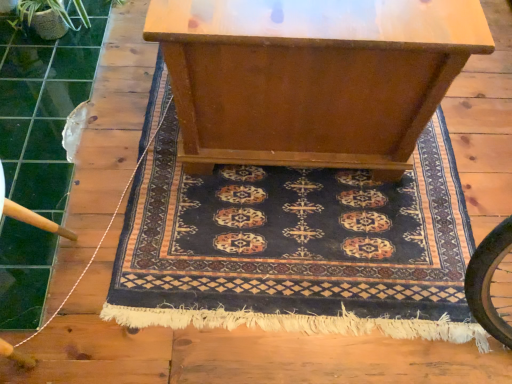
Question: From the image's perspective, is dark blue woven rug at center below wooden table at center?

Choices:
 (A) no
 (B) yes

Answer: (B)

Question: Can you see dark blue woven rug at center touching wooden table at center?

Choices:
 (A) no
 (B) yes

Answer: (A)

Question: Is the position of dark blue woven rug at center more distant than that of wooden table at center?

Choices:
 (A) yes
 (B) no

Answer: (A)

Question: Can you confirm if dark blue woven rug at center is shorter than wooden table at center?

Choices:
 (A) yes
 (B) no

Answer: (A)

Question: From the image's perspective, is dark blue woven rug at center on top of wooden table at center?

Choices:
 (A) no
 (B) yes

Answer: (A)

Question: Does point [x=414, y=208] appear closer or farther from the camera than point [x=45, y=327]?

Choices:
 (A) closer
 (B) farther

Answer: (B)

Question: From a real-world perspective, is dark blue woven rug at center physically located above or below white string at left?

Choices:
 (A) below
 (B) above

Answer: (A)

Question: From the image's perspective, is dark blue woven rug at center above or below white string at left?

Choices:
 (A) above
 (B) below

Answer: (B)

Question: Considering their positions, is dark blue woven rug at center located in front of or behind white string at left?

Choices:
 (A) behind
 (B) front

Answer: (A)

Question: Considering the relative positions of white string at left and green textured plant at upper left in the image provided, is white string at left to the left or to the right of green textured plant at upper left?

Choices:
 (A) right
 (B) left

Answer: (B)

Question: From the image's perspective, relative to green textured plant at upper left, is white string at left above or below?

Choices:
 (A) above
 (B) below

Answer: (B)

Question: Is white string at left taller or shorter than green textured plant at upper left?

Choices:
 (A) tall
 (B) short

Answer: (B)

Question: Is point (143, 150) positioned closer to the camera than point (55, 3)?

Choices:
 (A) closer
 (B) farther

Answer: (A)

Question: From a real-world perspective, is green textured plant at upper left positioned above or below wooden table at center?

Choices:
 (A) above
 (B) below

Answer: (B)

Question: Considering the positions of green textured plant at upper left and wooden table at center in the image, is green textured plant at upper left wider or thinner than wooden table at center?

Choices:
 (A) wide
 (B) thin

Answer: (B)